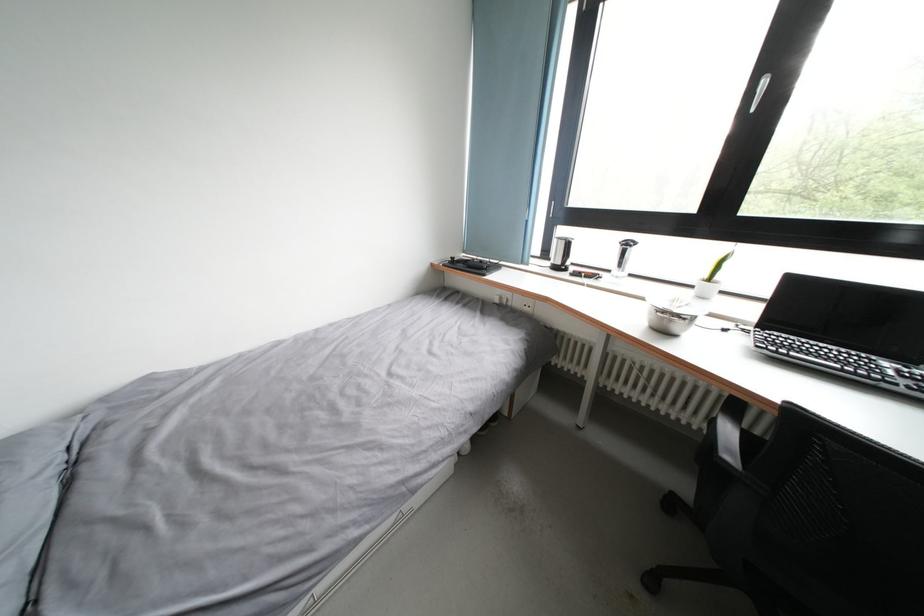
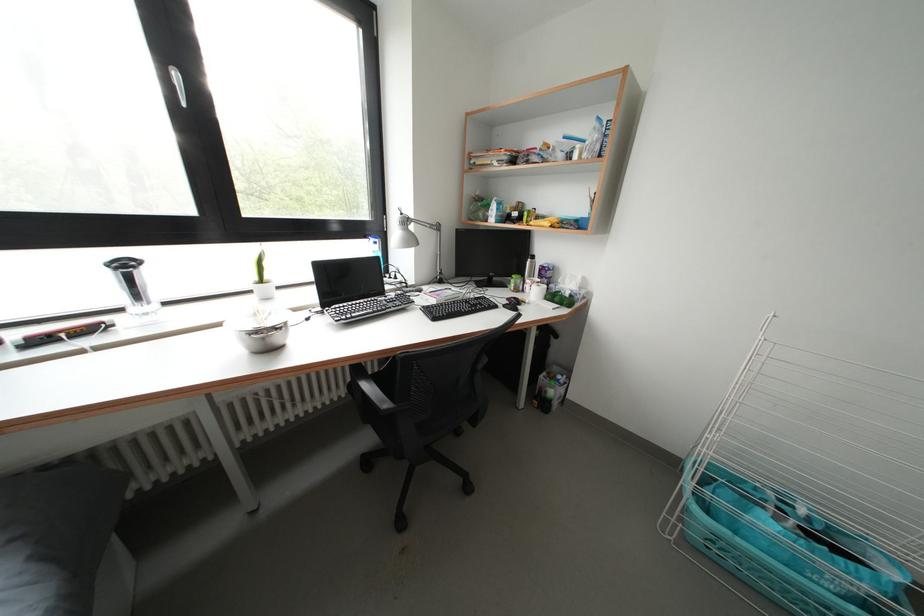
The point at (634, 249) is marked in the first image. Where is the corresponding point in the second image?

(131, 270)